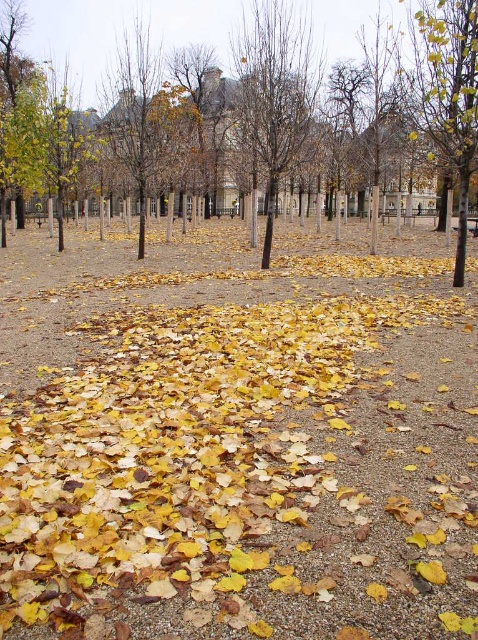
You are standing at the starting point of the gravel path in the park. You see two points marked on the ground ahead of you. The first point is labeled as point (214, 381) and the second is point (447, 65). Which point is closer to you?

Point (214, 381) is in front of point (447, 65), so it is closer to you.

You are standing on the gravel path in the park and notice the yellow dry leaves at center and the yellow leafy tree at center. Which object is closer to the ground?

The yellow dry leaves at center are closer to the ground because they have a lesser height compared to the yellow leafy tree at center.

You are standing on the gravel path in the autumn park and notice the yellow dry leaves at center and the bare branches at center. Which object is positioned more to the left?

The yellow dry leaves at center is positioned more to the left than the bare branches at center.